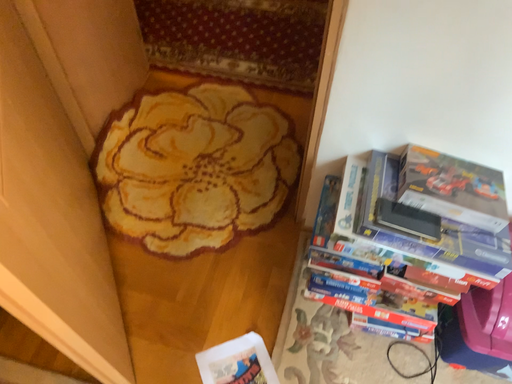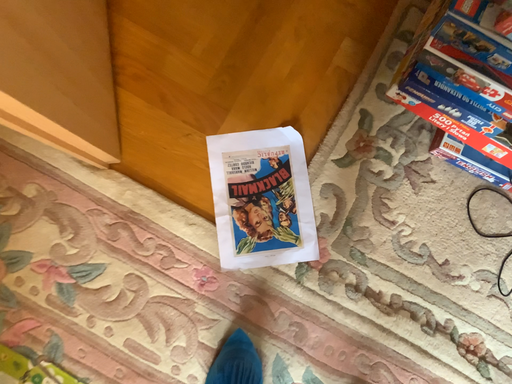
Question: Which way did the camera rotate in the video?

Choices:
 (A) rotated left
 (B) rotated right

Answer: (A)